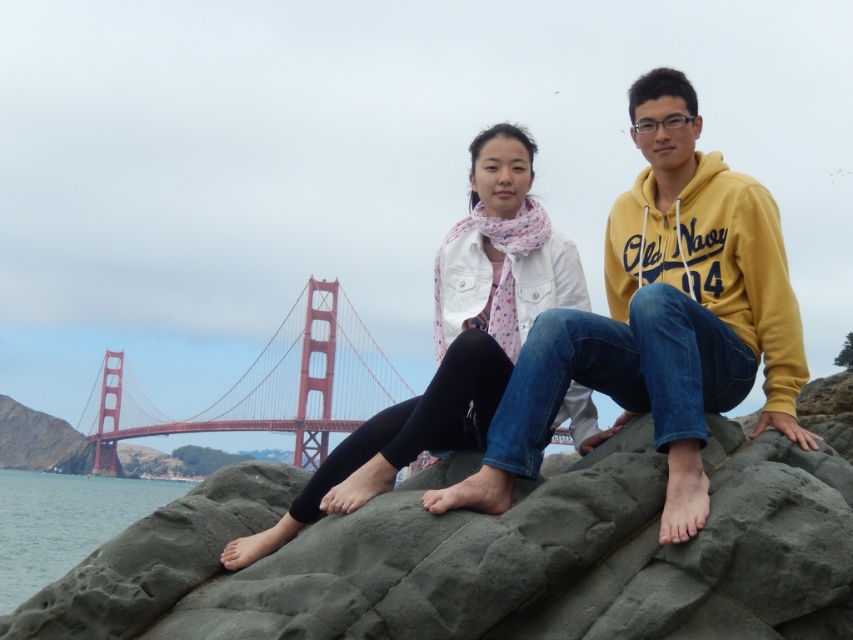
You are a photographer planning to take a photo of the matte yellow hoodie at center and the clear water at lower left. Based on their heights, which object should you focus on first if you want to ensure both are in the frame without moving the camera?

The matte yellow hoodie at center is shorter than the clear water at lower left, so you should focus on the clear water at lower left first to ensure both are in the frame.

You are a photographer standing at the location where the two people are sitting. You want to take a photo of the matte yellow hoodie at center and the clear water at lower left. How far apart are these two objects in the scene?

The matte yellow hoodie at center is 171.23 meters away from the clear water at lower left, so the distance between them is 171.23 meters.

Consider the image. You are planning to place a small picnic basket on the gray rough rock at center. Considering the size of the rock, will it be able to hold the basket without it falling into the clear water at lower left?

The gray rough rock at center is smaller than the clear water at lower left, so the rock may not provide enough stable surface area to securely hold the picnic basket, increasing the risk of it slipping into the water.